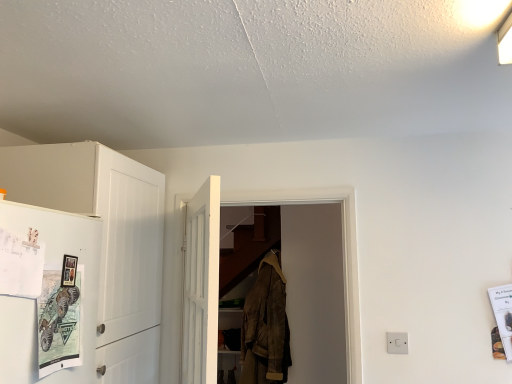
Describe the element at coordinates (58, 323) in the screenshot. I see `metallic poster at lower left` at that location.

Identify the location of white glossy refrigerator at left. (34, 300).

Image resolution: width=512 pixels, height=384 pixels. I want to click on white matte cabinet at left, so click(x=105, y=241).

I want to click on brown suede jacket at center, so click(x=266, y=326).

Consider the image. From a real-world perspective, which object rests below the other?

A: In real-world perspective, brown suede jacket at center is lower.

Which of these two, metallic poster at lower left or brown suede jacket at center, is wider?

brown suede jacket at center is wider.

Would you say metallic poster at lower left contains brown suede jacket at center?

That's incorrect, brown suede jacket at center is not inside metallic poster at lower left.

Is the surface of metallic poster at lower left in direct contact with brown suede jacket at center?

They are not placed beside each other.

Is white wooden door at center, the first door positioned from the back, not inside white matte cabinet at left?

That's correct, white wooden door at center, the first door positioned from the back, is outside of white matte cabinet at left.

Does white wooden door at center, the first door positioned from the back, have a lesser width compared to white matte cabinet at left?

Indeed, white wooden door at center, the first door positioned from the back, has a lesser width compared to white matte cabinet at left.

Does white wooden door at center, the first door positioned from the back, come in front of white matte cabinet at left?

No, white wooden door at center, the first door positioned from the back, is further to the viewer.

Is white wooden door at center, positioned as the second door in front-to-back order, turned away from white matte cabinet at left?

No, white wooden door at center, positioned as the second door in front-to-back order, is not facing away from white matte cabinet at left.

Considering the positions of objects white plastic switch at lower right and white matte cabinet at left in the image provided, who is more to the left, white plastic switch at lower right or white matte cabinet at left?

white matte cabinet at left.

Where is `cabinetry that appears above the white plastic switch at lower right (from the image's perspective)`? cabinetry that appears above the white plastic switch at lower right (from the image's perspective) is located at coordinates (105, 241).

Is white plastic switch at lower right thinner than white matte cabinet at left?

Indeed, white plastic switch at lower right has a lesser width compared to white matte cabinet at left.

From a real-world perspective, which object stands above the other?

In real-world perspective, white matte cabinet at left is above.

Choose the correct answer: Is brown suede jacket at center inside metallic poster at lower left or outside it?

brown suede jacket at center is not enclosed by metallic poster at lower left.

Who is shorter, brown suede jacket at center or metallic poster at lower left?

With less height is metallic poster at lower left.

Does point (270, 322) lie in front of point (66, 340)?

No, it is not.

Between brown suede jacket at center and metallic poster at lower left, which one has smaller size?

metallic poster at lower left.

Considering the positions of point (276, 338) and point (392, 333), is point (276, 338) closer or farther from the camera than point (392, 333)?

Point (276, 338) appears to be farther away from the viewer than point (392, 333).

Looking at this image, from the image's perspective, is brown suede jacket at center located above white plastic switch at lower right?

No.

Locate an element on the screen. Image resolution: width=512 pixels, height=384 pixels. electric outlet located in front of the brown suede jacket at center is located at coordinates (397, 342).

Is brown suede jacket at center oriented away from white plastic switch at lower right?

No.

Looking at this image, from the image's perspective, which one is positioned higher, white matte cabinet at left or brown suede jacket at center?

From the image's view, white matte cabinet at left is above.

From a real-world perspective, is white matte cabinet at left above or below brown suede jacket at center?

white matte cabinet at left is situated higher than brown suede jacket at center in the real world.

Considering the relative positions of white matte cabinet at left and brown suede jacket at center in the image provided, is white matte cabinet at left to the left or to the right of brown suede jacket at center?

white matte cabinet at left is positioned on brown suede jacket at center's left side.

This screenshot has height=384, width=512. Find the location of `fridge that appears below the white matte cabinet at left (from a real-world perspective)`. fridge that appears below the white matte cabinet at left (from a real-world perspective) is located at coordinates (34, 300).

Does white glossy refrigerator at left have a greater height compared to white matte cabinet at left?

In fact, white glossy refrigerator at left may be shorter than white matte cabinet at left.

Considering the sizes of objects white glossy refrigerator at left and white matte cabinet at left in the image provided, who is wider, white glossy refrigerator at left or white matte cabinet at left?

Wider between the two is white matte cabinet at left.

Considering the relative sizes of white glossy refrigerator at left and white matte cabinet at left in the image provided, is white glossy refrigerator at left bigger than white matte cabinet at left?

Incorrect, white glossy refrigerator at left is not larger than white matte cabinet at left.

The width and height of the screenshot is (512, 384). What are the coordinates of `poster that is above the brown suede jacket at center (from the image's perspective)` in the screenshot? It's located at (58, 323).

What are the coordinates of `door that appears behind the white matte cabinet at left` in the screenshot? It's located at (217, 270).

Which object lies further to the anchor point white matte cabinet at left, white wooden door at center, the first door positioned from the back, or white plastic switch at lower right?

white plastic switch at lower right lies further to white matte cabinet at left than the other object.

Looking at the image, which one is located closer to white wooden door at center, which is counted as the first door, starting from the front, metallic poster at lower left or white wooden door at center, the first door positioned from the back?

The object closer to white wooden door at center, which is counted as the first door, starting from the front, is white wooden door at center, the first door positioned from the back.

Estimate the real-world distances between objects in this image. Which object is closer to white matte cabinet at left, brown suede jacket at center or white wooden door at center, which is counted as the first door, starting from the front?

Based on the image, white wooden door at center, which is counted as the first door, starting from the front, appears to be nearer to white matte cabinet at left.

Based on their spatial positions, is metallic poster at lower left or brown suede jacket at center closer to white matte cabinet at left?

Based on the image, metallic poster at lower left appears to be nearer to white matte cabinet at left.

From the image, which object appears to be farther from white plastic switch at lower right, metallic poster at lower left or brown suede jacket at center?

metallic poster at lower left is positioned further to the anchor white plastic switch at lower right.

Estimate the real-world distances between objects in this image. Which object is further from white matte cabinet at left, white wooden door at center, which is counted as the first door, starting from the front, or white wooden door at center, positioned as the second door in front-to-back order?

Among the two, white wooden door at center, positioned as the second door in front-to-back order, is located further to white matte cabinet at left.

When comparing their distances from white plastic switch at lower right, does white matte cabinet at left or white wooden door at center, which is counted as the first door, starting from the front, seem further?

white matte cabinet at left lies further to white plastic switch at lower right than the other object.

Considering their positions, is brown suede jacket at center positioned further to white matte cabinet at left than white glossy refrigerator at left?

brown suede jacket at center.

Locate an element on the screen. Image resolution: width=512 pixels, height=384 pixels. poster between white matte cabinet at left and white plastic switch at lower right in the horizontal direction is located at coordinates (58, 323).

You are a GUI agent. You are given a task and a screenshot of the screen. Output one action in this format:
    pyautogui.click(x=<x>, y=<y>)
    Task: Click on the fridge between white matte cabinet at left and white wooden door at center, the second door positioned from the back
    This screenshot has width=512, height=384.
    Given the screenshot: What is the action you would take?
    pyautogui.click(x=34, y=300)

This screenshot has height=384, width=512. What are the coordinates of `door between metallic poster at lower left and white wooden door at center, the first door positioned from the back, from front to back` in the screenshot? It's located at (201, 285).

Identify the location of electric outlet positioned between white wooden door at center, the second door positioned from the back, and brown suede jacket at center from near to far. This screenshot has height=384, width=512. (397, 342).